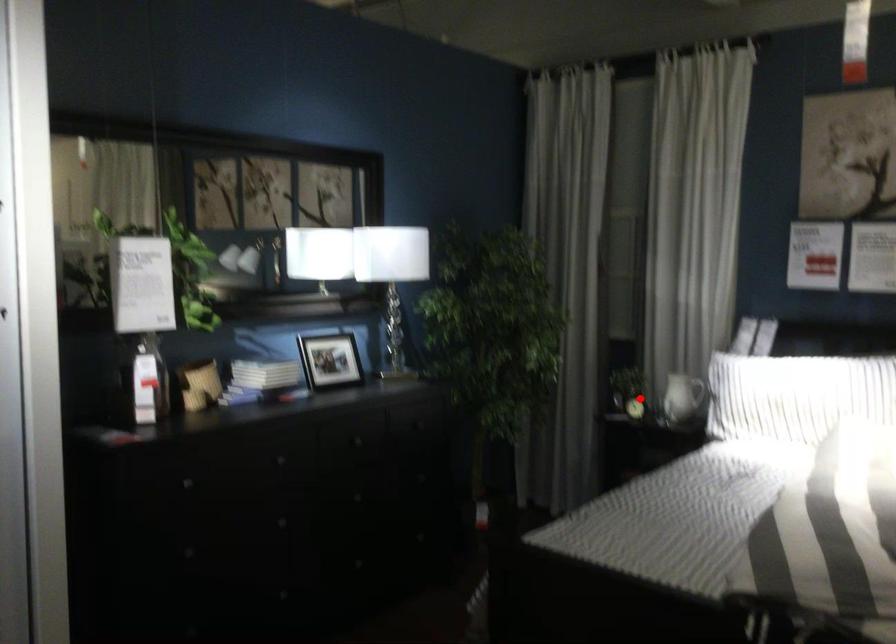
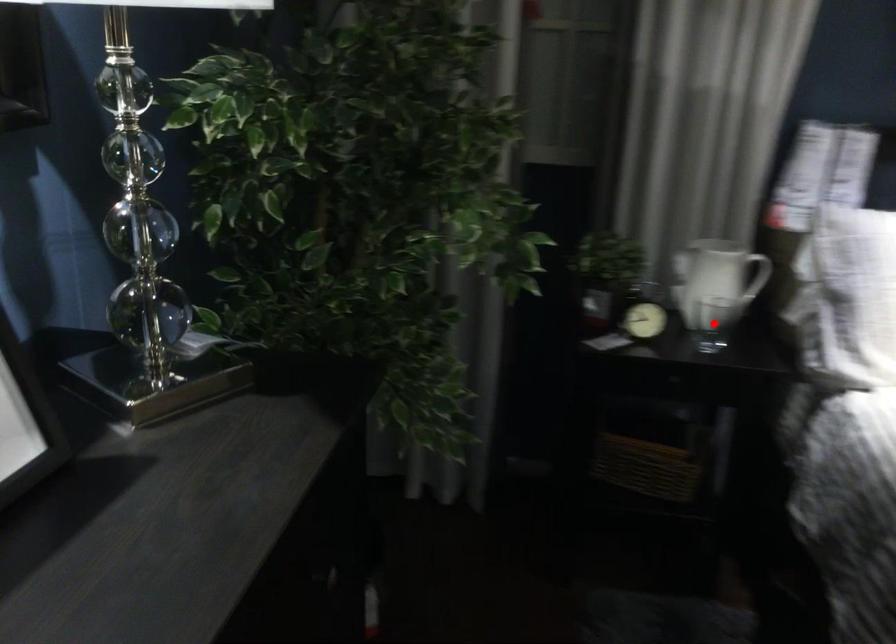
I am providing you with two images of the same scene from different viewpoints. A red point is marked on the first image and another point is marked on the second image. Is the marked point in image1 the same physical position as the marked point in image2?

No